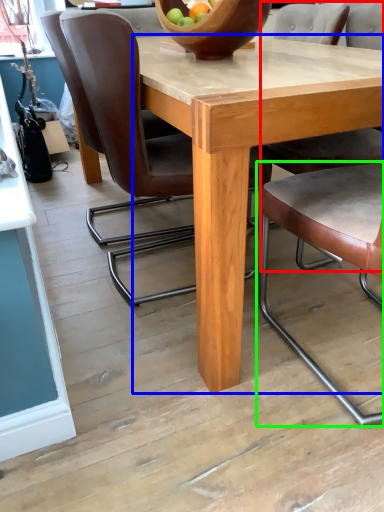
Question: Which is nearer to the chair (highlighted by a red box)? round table (highlighted by a blue box) or chair (highlighted by a green box).

Choices:
 (A) round table
 (B) chair

Answer: (A)